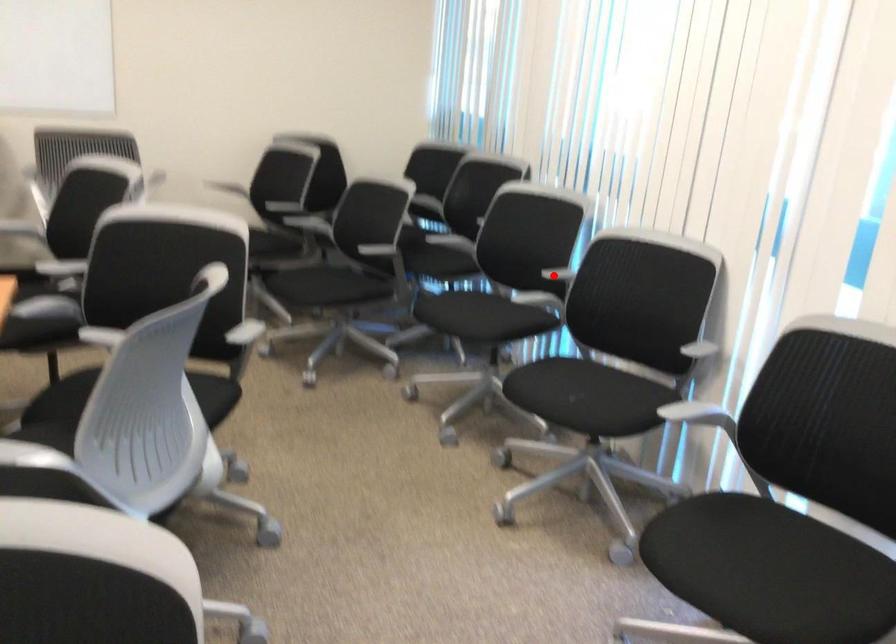
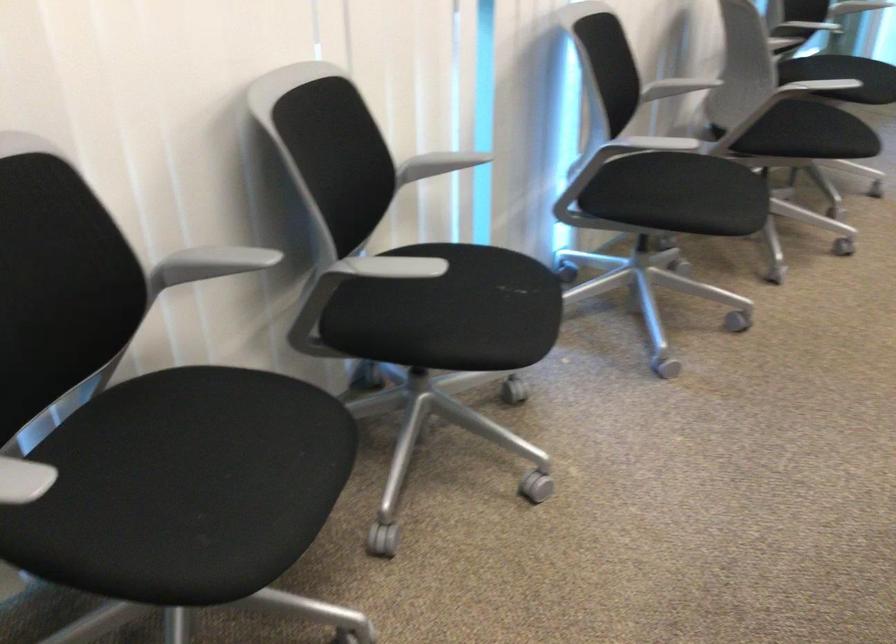
Question: I am providing you with two images of the same scene from different viewpoints. In image1, a red point is highlighted. Considering the same 3D point in image2, which of the following is correct?

Choices:
 (A) It is closer
 (B) It is farther

Answer: (A)